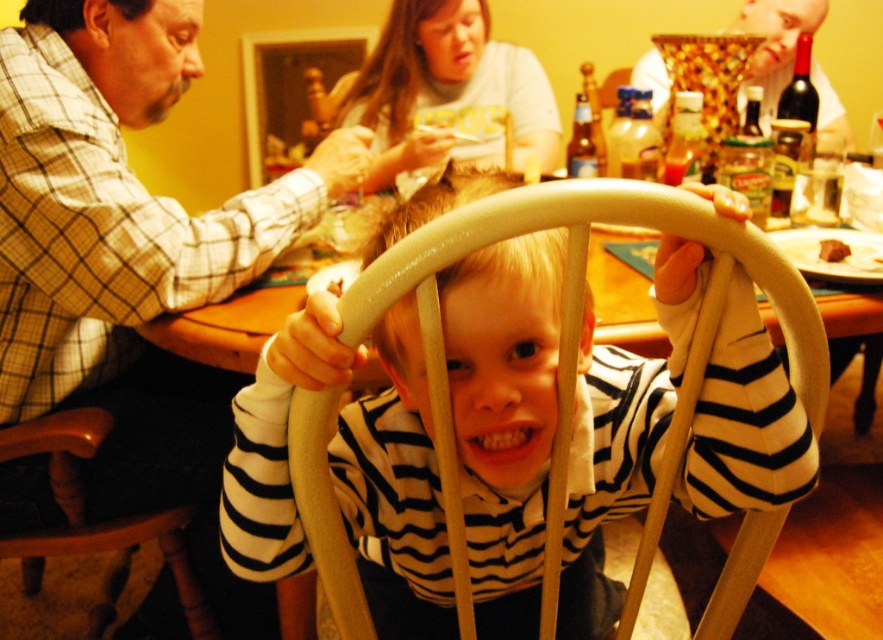
You are a guest at this family gathering and want to place a small vase on the wooden chair at lower left. The vase is the same width as the smooth gold bowl at upper right. Will the vase fit on the chair?

The wooden chair at lower left is thinner than the smooth gold bowl at upper right. Since the vase has the same width as the bowl, it will not fit on the chair because the chair is narrower.

You are a photographer at the family gathering and want to capture both the white striped shirt at center and the white cotton shirt at upper center in the same frame. Which shirt should you focus on first to ensure both are in the frame?

You should focus on the white striped shirt at center first because it is larger in size than the white cotton shirt at upper center, so it will occupy more space in the frame, ensuring both shirts are visible.